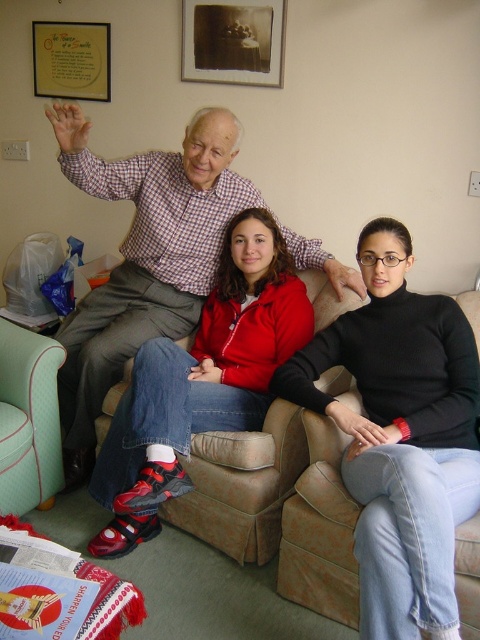
Describe the element at coordinates (400, 435) in the screenshot. I see `black turtleneck sweater at center` at that location.

Is point (380, 352) closer to viewer compared to point (11, 387)?

Yes, it is.

Find the location of `black turtleneck sweater at center`. black turtleneck sweater at center is located at coordinates (400, 435).

Which is more to the left, checkered fabric shirt at upper left or matte red jacket at center?

checkered fabric shirt at upper left is more to the left.

Measure the distance between checkered fabric shirt at upper left and camera.

A distance of 6.03 feet exists between checkered fabric shirt at upper left and camera.

In order to click on checkered fabric shirt at upper left in this screenshot , I will do `click(144, 257)`.

Which is above, matte red jacket at center or mint green fabric armchair at lower left?

Positioned higher is matte red jacket at center.

I want to click on matte red jacket at center, so click(201, 381).

Image resolution: width=480 pixels, height=640 pixels. Identify the location of matte red jacket at center. (201, 381).